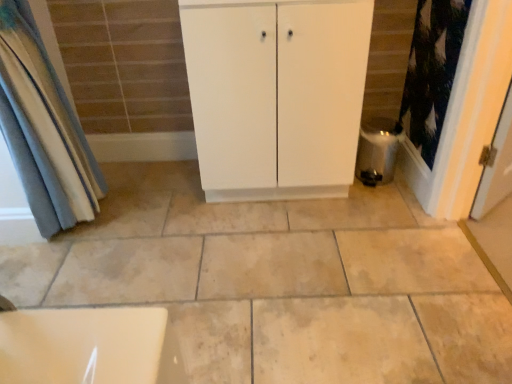
The width and height of the screenshot is (512, 384). What do you see at coordinates (42, 128) in the screenshot?
I see `blue fabric curtain at left` at bounding box center [42, 128].

You are a GUI agent. You are given a task and a screenshot of the screen. Output one action in this format:
    pyautogui.click(x=<x>, y=<y>)
    Task: Click on the white matte cabinet at center
    This screenshot has height=384, width=512.
    Given the screenshot: What is the action you would take?
    pyautogui.click(x=276, y=95)

What do you see at coordinates (276, 95) in the screenshot?
I see `white matte cabinet at center` at bounding box center [276, 95].

You are a GUI agent. You are given a task and a screenshot of the screen. Output one action in this format:
    pyautogui.click(x=<x>, y=<y>)
    Task: Click on the blue fabric curtain at left
    
    Given the screenshot: What is the action you would take?
    pyautogui.click(x=42, y=128)

Considering the relative sizes of white matte cabinet at center and blue fabric curtain at left in the image provided, is white matte cabinet at center shorter than blue fabric curtain at left?

Correct, white matte cabinet at center is not as tall as blue fabric curtain at left.

The image size is (512, 384). There is a white matte cabinet at center. In order to click on curtain above it (from a real-world perspective) in this screenshot , I will do `click(42, 128)`.

Is white matte cabinet at center touching blue fabric curtain at left?

white matte cabinet at center is not next to blue fabric curtain at left, and they're not touching.

Can you confirm if white matte cabinet at center is smaller than blue fabric curtain at left?

No, white matte cabinet at center is not smaller than blue fabric curtain at left.

From the image's perspective, is satin silver water heater at lower right on top of white matte cabinet at center?

No, from the image's perspective, satin silver water heater at lower right is not above white matte cabinet at center.

Is satin silver water heater at lower right far from white matte cabinet at center?

No, satin silver water heater at lower right is not far from white matte cabinet at center.

Which of these two, satin silver water heater at lower right or white matte cabinet at center, stands taller?

white matte cabinet at center is taller.

Is white matte cabinet at center further to camera compared to satin silver water heater at lower right?

That is False.

From a real-world perspective, is white matte cabinet at center physically above satin silver water heater at lower right?

Yes, from a real-world perspective, white matte cabinet at center is over satin silver water heater at lower right

You are a GUI agent. You are given a task and a screenshot of the screen. Output one action in this format:
    pyautogui.click(x=<x>, y=<y>)
    Task: Click on the bathroom cabinet on the left of satin silver water heater at lower right
    This screenshot has width=512, height=384.
    Given the screenshot: What is the action you would take?
    pyautogui.click(x=276, y=95)

In the scene shown: Is blue fabric curtain at left directly adjacent to white matte cabinet at center?

There is a gap between blue fabric curtain at left and white matte cabinet at center.

Considering the sizes of objects blue fabric curtain at left and white matte cabinet at center in the image provided, who is thinner, blue fabric curtain at left or white matte cabinet at center?

blue fabric curtain at left.

From the image's perspective, would you say blue fabric curtain at left is positioned over white matte cabinet at center?

No, from the image's perspective, blue fabric curtain at left is not above white matte cabinet at center.

In terms of size, does blue fabric curtain at left appear bigger or smaller than white matte cabinet at center?

In the image, blue fabric curtain at left appears to be smaller than white matte cabinet at center.

Is blue fabric curtain at left touching satin silver water heater at lower right?

They are not placed beside each other.

Is blue fabric curtain at left facing towards satin silver water heater at lower right?

Yes.

Who is bigger, blue fabric curtain at left or satin silver water heater at lower right?

blue fabric curtain at left.

From the image's perspective, which is below, blue fabric curtain at left or satin silver water heater at lower right?

satin silver water heater at lower right is shown below in the image.

Which of these two, satin silver water heater at lower right or blue fabric curtain at left, is thinner?

Thinner between the two is blue fabric curtain at left.

Does satin silver water heater at lower right have a greater height compared to blue fabric curtain at left?

Incorrect, the height of satin silver water heater at lower right is not larger of that of blue fabric curtain at left.

From the image's perspective, which is below, satin silver water heater at lower right or blue fabric curtain at left?

satin silver water heater at lower right is shown below in the image.

Is satin silver water heater at lower right oriented away from blue fabric curtain at left?

satin silver water heater at lower right is not turned away from blue fabric curtain at left.

There is a white matte cabinet at center. At what (x,y) coordinates should I click in order to perform the action: click on curtain above it (from a real-world perspective). Please return your answer as a coordinate pair (x, y). Image resolution: width=512 pixels, height=384 pixels. Looking at the image, I should click on (42, 128).

The width and height of the screenshot is (512, 384). In order to click on water heater that is on the right side of white matte cabinet at center in this screenshot , I will do `click(378, 150)`.

Consider the image. Considering their positions, is satin silver water heater at lower right positioned closer to white matte cabinet at center than blue fabric curtain at left?

The object closer to white matte cabinet at center is satin silver water heater at lower right.

Looking at the image, which one is located closer to satin silver water heater at lower right, blue fabric curtain at left or white matte cabinet at center?

white matte cabinet at center is positioned closer to the anchor satin silver water heater at lower right.

When comparing their distances from blue fabric curtain at left, does satin silver water heater at lower right or white matte cabinet at center seem closer?

The object closer to blue fabric curtain at left is white matte cabinet at center.

In the scene shown: Which object lies further to the anchor point satin silver water heater at lower right, white matte cabinet at center or blue fabric curtain at left?

blue fabric curtain at left is further to satin silver water heater at lower right.

When comparing their distances from blue fabric curtain at left, does white matte cabinet at center or satin silver water heater at lower right seem further?

satin silver water heater at lower right.

Estimate the real-world distances between objects in this image. Which object is further from white matte cabinet at center, blue fabric curtain at left or satin silver water heater at lower right?

Based on the image, blue fabric curtain at left appears to be further to white matte cabinet at center.

This screenshot has height=384, width=512. In order to click on bathroom cabinet between blue fabric curtain at left and satin silver water heater at lower right in this screenshot , I will do `click(276, 95)`.